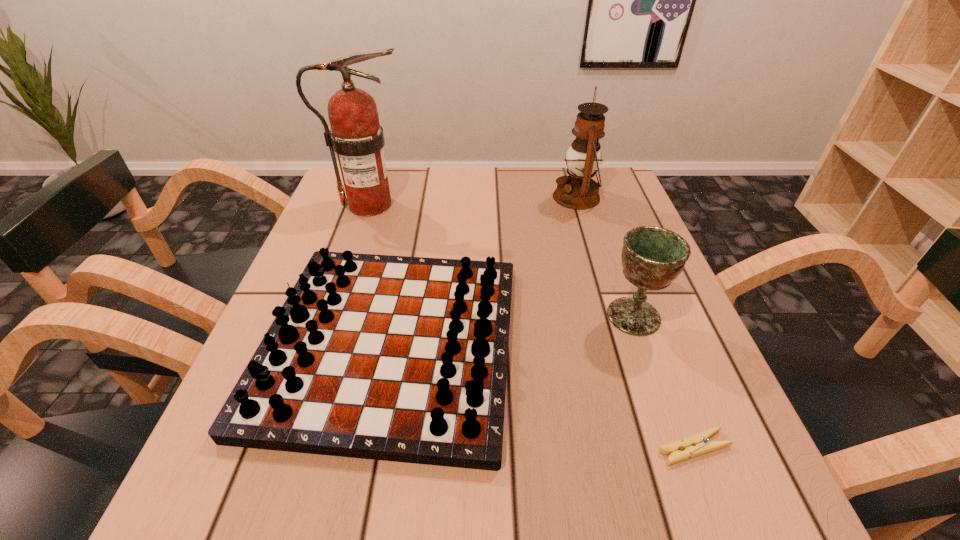
Where is `vacant space in between the tallest object and the chalice`? The height and width of the screenshot is (540, 960). vacant space in between the tallest object and the chalice is located at coordinates (501, 260).

Where is `vacant space that's between the fourth shortest object and the chalice`? This screenshot has width=960, height=540. vacant space that's between the fourth shortest object and the chalice is located at coordinates (605, 256).

In order to click on empty location between the lantern and the third shortest object in this screenshot , I will do `click(605, 256)`.

The image size is (960, 540). In order to click on vacant region between the third shortest object and the lantern in this screenshot , I will do `click(605, 256)`.

The width and height of the screenshot is (960, 540). Find the location of `vacant point located between the third shortest object and the fire extinguisher`. vacant point located between the third shortest object and the fire extinguisher is located at coordinates click(501, 260).

This screenshot has width=960, height=540. I want to click on vacant area between the fire extinguisher and the chalice, so click(x=501, y=260).

The width and height of the screenshot is (960, 540). I want to click on object that is the fourth closest one to the tallest object, so click(698, 444).

Point out which object is positioned as the third nearest to the chessboard. Please provide its 2D coordinates. Your answer should be formatted as a tuple, i.e. [(x, y)], where the tuple contains the x and y coordinates of a point satisfying the conditions above.

[(698, 444)]

What are the coordinates of `free location that satisfies the following two spatial constraints: 1. at the nozzle of the fire extinguisher; 2. on the back side of the third tallest object` in the screenshot? It's located at (332, 316).

Locate an element on the screen. This screenshot has width=960, height=540. vacant region that satisfies the following two spatial constraints: 1. at the nozzle of the tallest object; 2. on the left side of the clothespin is located at coordinates (287, 448).